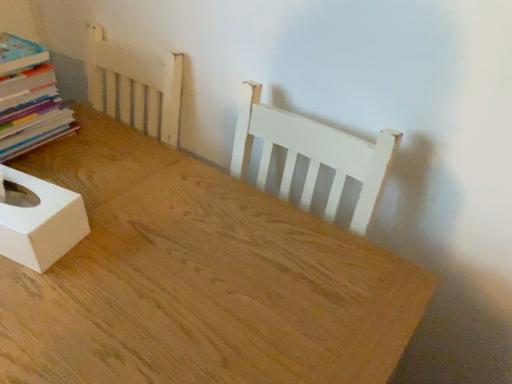
You are a GUI agent. You are given a task and a screenshot of the screen. Output one action in this format:
    pyautogui.click(x=<x>, y=<y>)
    Task: Click on the vacant space behind white matte tissue box at lower left
    The height and width of the screenshot is (384, 512).
    Given the screenshot: What is the action you would take?
    pyautogui.click(x=86, y=164)